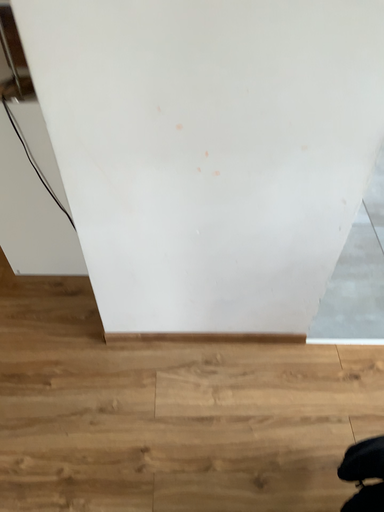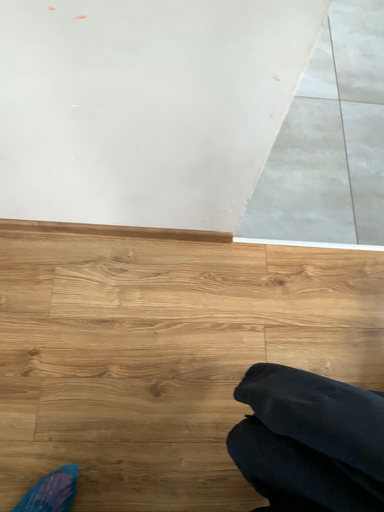
Question: How did the camera likely rotate when shooting the video?

Choices:
 (A) rotated upward
 (B) rotated downward

Answer: (B)